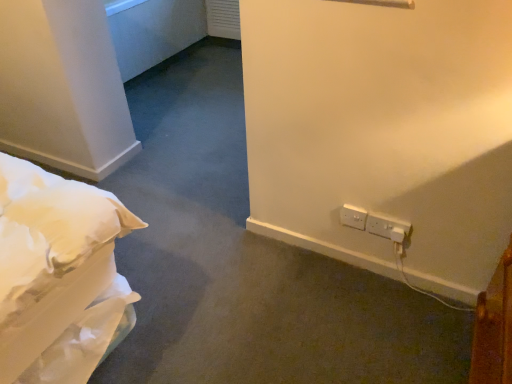
Question: In the image, is white plastic electrical outlet at lower right, the first electric outlet positioned from the right, positioned in front of or behind white plastic electric outlet at lower right, which is the first electric outlet from left to right?

Choices:
 (A) behind
 (B) front

Answer: (B)

Question: From a real-world perspective, is white plastic electrical outlet at lower right, the 2th electric outlet in the left-to-right sequence, positioned above or below white plastic electric outlet at lower right, which is the first electric outlet from left to right?

Choices:
 (A) below
 (B) above

Answer: (A)

Question: Considering the positions of white plastic electrical outlet at lower right, the first electric outlet positioned from the right, and white plastic electric outlet at lower right, the second electric outlet positioned from the right, in the image, is white plastic electrical outlet at lower right, the first electric outlet positioned from the right, taller or shorter than white plastic electric outlet at lower right, the second electric outlet positioned from the right,?

Choices:
 (A) short
 (B) tall

Answer: (A)

Question: From the image's perspective, relative to white plastic electrical outlet at lower right, the first electric outlet positioned from the right, is white plastic electric outlet at lower right, the second electric outlet positioned from the right, above or below?

Choices:
 (A) above
 (B) below

Answer: (A)

Question: Based on their sizes in the image, would you say white plastic electric outlet at lower right, which is the first electric outlet from left to right, is bigger or smaller than white plastic electrical outlet at lower right, the 2th electric outlet in the left-to-right sequence?

Choices:
 (A) small
 (B) big

Answer: (A)

Question: In terms of height, does white plastic electric outlet at lower right, which is the first electric outlet from left to right, look taller or shorter compared to white plastic electrical outlet at lower right, the 2th electric outlet in the left-to-right sequence?

Choices:
 (A) short
 (B) tall

Answer: (B)

Question: From a real-world perspective, is white plastic electric outlet at lower right, which is the first electric outlet from left to right, physically located above or below white plastic electrical outlet at lower right, the first electric outlet positioned from the right?

Choices:
 (A) below
 (B) above

Answer: (B)